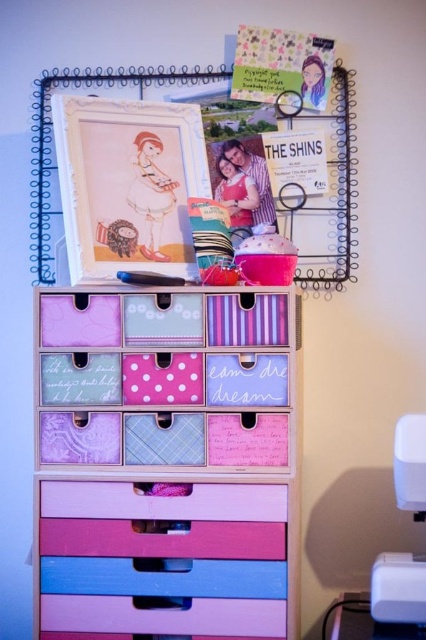
You are setting up a workspace in the storage unit and need to place both the pastel wood drawers at center and the white plastic sewing machine at lower right. If you want to place them side by side, which object should be placed on the left to ensure they fit within the available space?

The pastel wood drawers at center should be placed on the left since they are smaller in size compared to the white plastic sewing machine at lower right, allowing both to fit side by side without overcrowding.